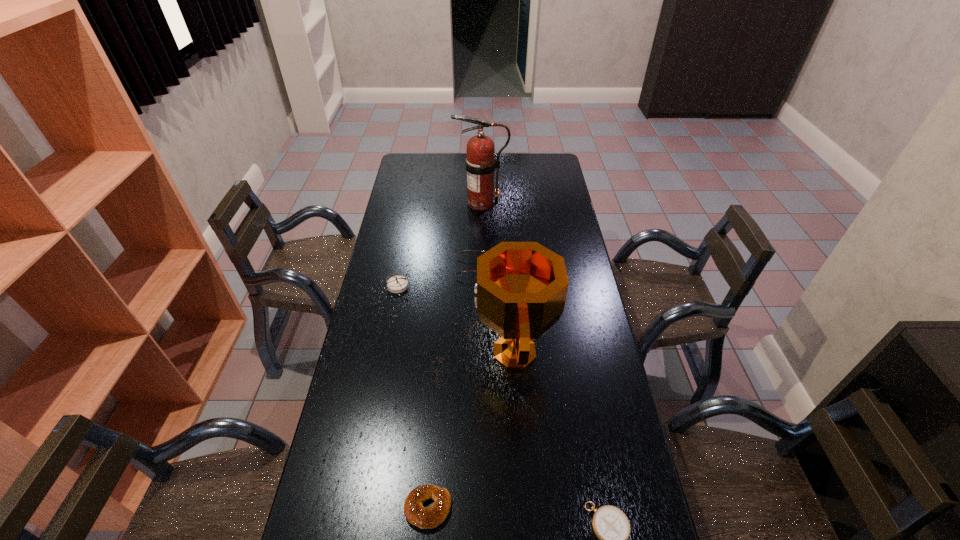
Locate an element on the screen. The width and height of the screenshot is (960, 540). vacant position located on the side of the third nearest object with the star emblem is located at coordinates (449, 353).

Identify the location of free space located on the side of the third nearest object with the star emblem. (437, 353).

Find the location of a particular element. free region located on the front of the left compass is located at coordinates (392, 316).

Where is `vacant space positioned on the front-facing side of the fifth nearest object`? The width and height of the screenshot is (960, 540). vacant space positioned on the front-facing side of the fifth nearest object is located at coordinates (540, 267).

The width and height of the screenshot is (960, 540). I want to click on free space located on the back of the fifth tallest object, so click(x=435, y=422).

The image size is (960, 540). I want to click on object at the left edge, so pyautogui.click(x=396, y=284).

Locate an element on the screen. The width and height of the screenshot is (960, 540). vacant space at the far edge is located at coordinates (463, 157).

You are a GUI agent. You are given a task and a screenshot of the screen. Output one action in this format:
    pyautogui.click(x=<x>, y=<y>)
    Task: Click on the vacant space at the left edge
    
    Given the screenshot: What is the action you would take?
    pyautogui.click(x=400, y=223)

Identify the location of vacant area at the right edge. (568, 335).

In the image, there is a desktop. Where is `vacant space at the far right corner`? vacant space at the far right corner is located at coordinates (540, 164).